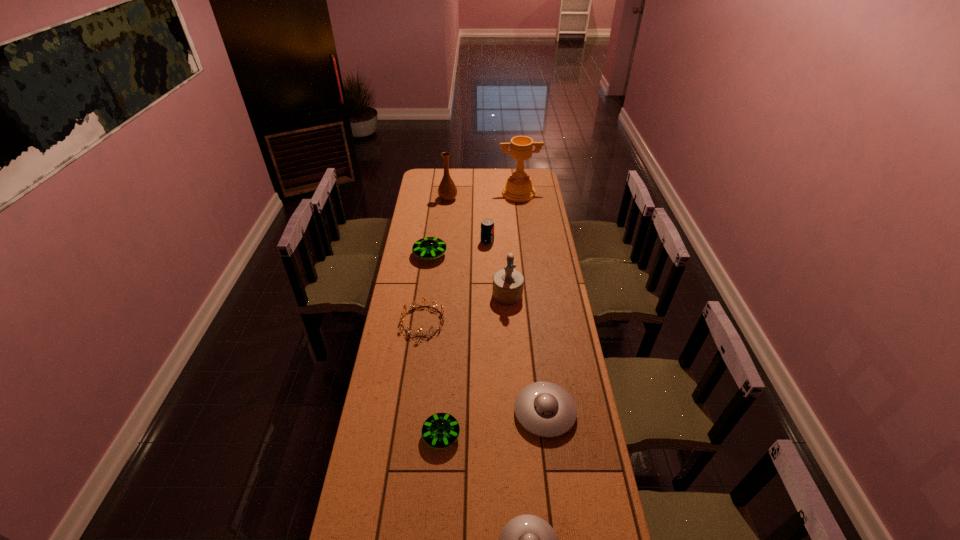
At what (x,y) coordinates should I click in order to perform the action: click on object positioned at the far edge. Please return your answer as a coordinate pair (x, y). This screenshot has width=960, height=540. Looking at the image, I should click on (518, 188).

Where is `vase positioned at the left edge`? vase positioned at the left edge is located at coordinates (447, 191).

What are the coordinates of `saucer at the left edge` in the screenshot? It's located at (427, 248).

Locate an element on the screen. The height and width of the screenshot is (540, 960). tiara located in the left edge section of the desktop is located at coordinates (415, 302).

Image resolution: width=960 pixels, height=540 pixels. Find the location of `award located in the right edge section of the desktop`. award located in the right edge section of the desktop is located at coordinates (518, 188).

You are a GUI agent. You are given a task and a screenshot of the screen. Output one action in this format:
    pyautogui.click(x=<x>, y=<y>)
    Task: Click on the saucer present at the right edge
    The width and height of the screenshot is (960, 540).
    Given the screenshot: What is the action you would take?
    pyautogui.click(x=545, y=409)

What are the coordinates of `object present at the far right corner` in the screenshot? It's located at (518, 188).

The image size is (960, 540). I want to click on blank space at the left edge of the desktop, so click(406, 431).

In the image, there is a desktop. Where is `vacant space at the right edge`? The height and width of the screenshot is (540, 960). vacant space at the right edge is located at coordinates (536, 319).

At what (x,y) coordinates should I click in order to perform the action: click on blank space at the far right corner of the desktop. Please return your answer as a coordinate pair (x, y). The height and width of the screenshot is (540, 960). Looking at the image, I should click on (533, 171).